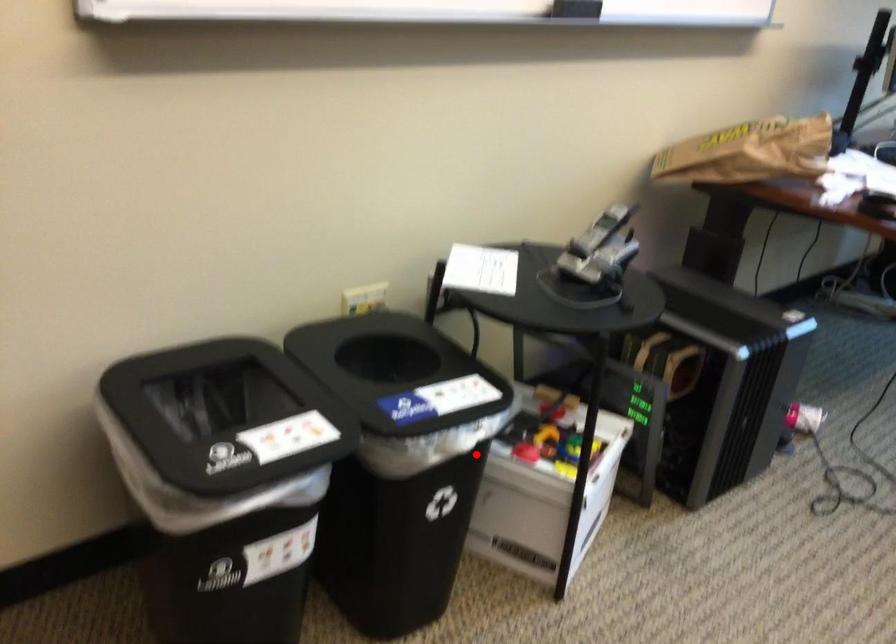
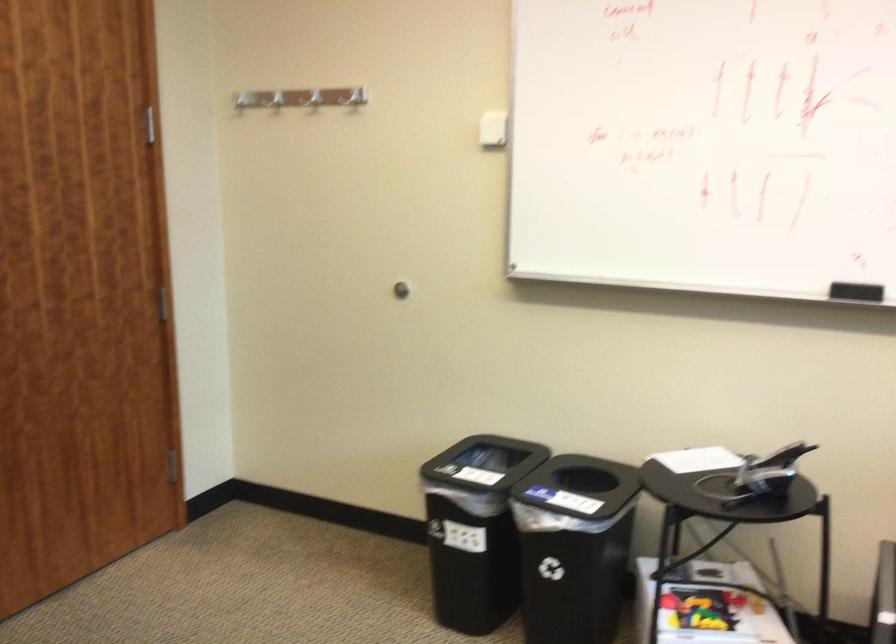
Question: I am providing you with two images of the same scene from different viewpoints. A red point is marked on the first image. At the location where the point appears in image 1, is it still visible in image 2?

Choices:
 (A) Yes
 (B) No

Answer: (A)